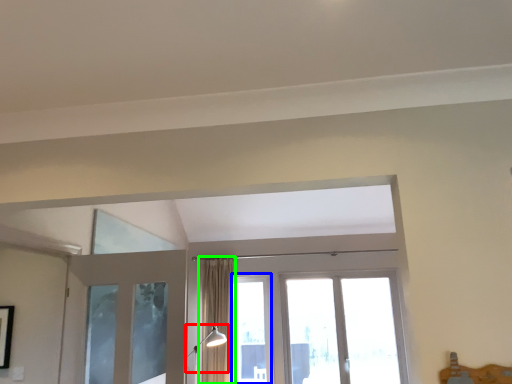
Question: Considering the real-world distances, which object is farthest from light fixture (highlighted by a red box)? window (highlighted by a blue box) or curtain (highlighted by a green box)?

Choices:
 (A) window
 (B) curtain

Answer: (A)